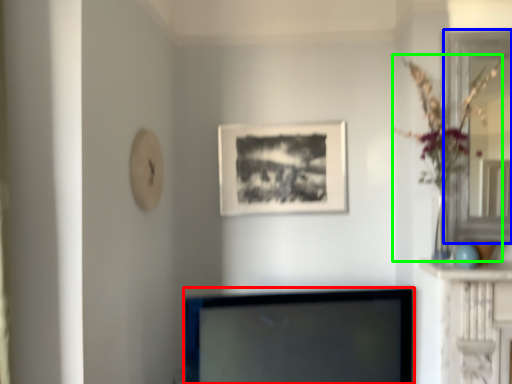
Question: Which object is the farthest from television (highlighted by a red box)? Choose among these: glass door (highlighted by a blue box) or floral arrangement (highlighted by a green box).

Choices:
 (A) glass door
 (B) floral arrangement

Answer: (A)